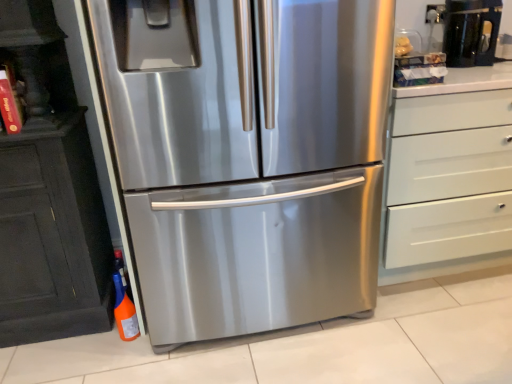
Question: Considering the relative sizes of stainless steel refrigerator at center and white matte chest of drawers at right in the image provided, is stainless steel refrigerator at center bigger than white matte chest of drawers at right?

Choices:
 (A) yes
 (B) no

Answer: (A)

Question: Does stainless steel refrigerator at center appear on the left side of white matte chest of drawers at right?

Choices:
 (A) no
 (B) yes

Answer: (B)

Question: Does stainless steel refrigerator at center have a smaller size compared to white matte chest of drawers at right?

Choices:
 (A) no
 (B) yes

Answer: (A)

Question: Is stainless steel refrigerator at center at the right side of white matte chest of drawers at right?

Choices:
 (A) yes
 (B) no

Answer: (B)

Question: Is stainless steel refrigerator at center facing towards white matte chest of drawers at right?

Choices:
 (A) no
 (B) yes

Answer: (A)

Question: From a real-world perspective, does stainless steel refrigerator at center sit lower than white matte chest of drawers at right?

Choices:
 (A) yes
 (B) no

Answer: (B)

Question: Considering the relative positions of orange matte bottle at lower left and white matte chest of drawers at right in the image provided, is orange matte bottle at lower left to the left of white matte chest of drawers at right from the viewer's perspective?

Choices:
 (A) no
 (B) yes

Answer: (B)

Question: From the image's perspective, does orange matte bottle at lower left appear lower than white matte chest of drawers at right?

Choices:
 (A) yes
 (B) no

Answer: (A)

Question: Can you confirm if orange matte bottle at lower left is wider than white matte chest of drawers at right?

Choices:
 (A) no
 (B) yes

Answer: (A)

Question: Is orange matte bottle at lower left to the right of white matte chest of drawers at right from the viewer's perspective?

Choices:
 (A) no
 (B) yes

Answer: (A)

Question: Is orange matte bottle at lower left directly adjacent to white matte chest of drawers at right?

Choices:
 (A) no
 (B) yes

Answer: (A)

Question: Is orange matte bottle at lower left further to camera compared to white matte chest of drawers at right?

Choices:
 (A) yes
 (B) no

Answer: (A)

Question: Considering the relative positions of black glossy coffee machine at upper right and orange matte bottle at lower left in the image provided, is black glossy coffee machine at upper right to the left of orange matte bottle at lower left from the viewer's perspective?

Choices:
 (A) no
 (B) yes

Answer: (A)